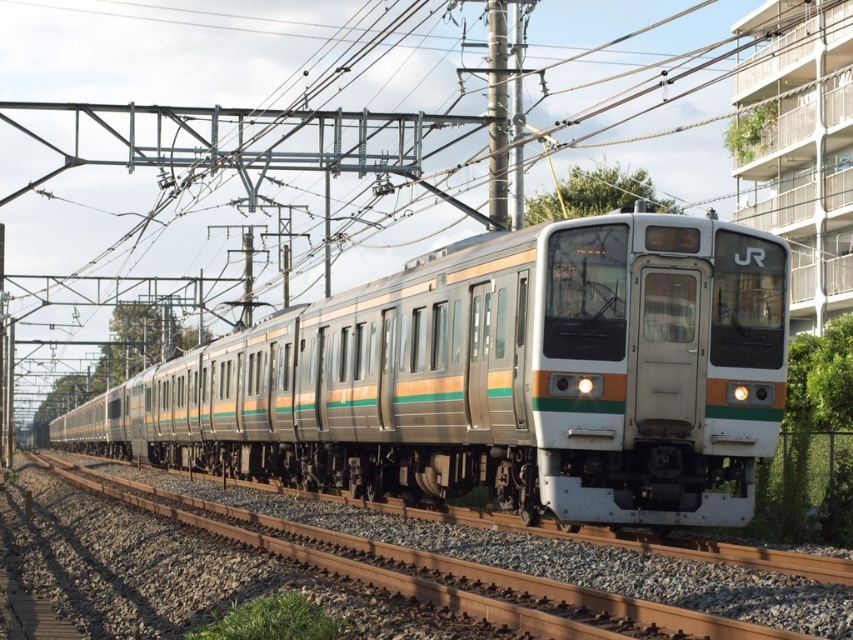
Who is more forward, [628,321] or [701,588]?

Positioned in front is point [701,588].

Who is more distant from viewer, (553, 244) or (465, 536)?

Positioned behind is point (465, 536).

The height and width of the screenshot is (640, 853). In order to click on silver metallic train at center in this screenshot , I will do `click(496, 378)`.